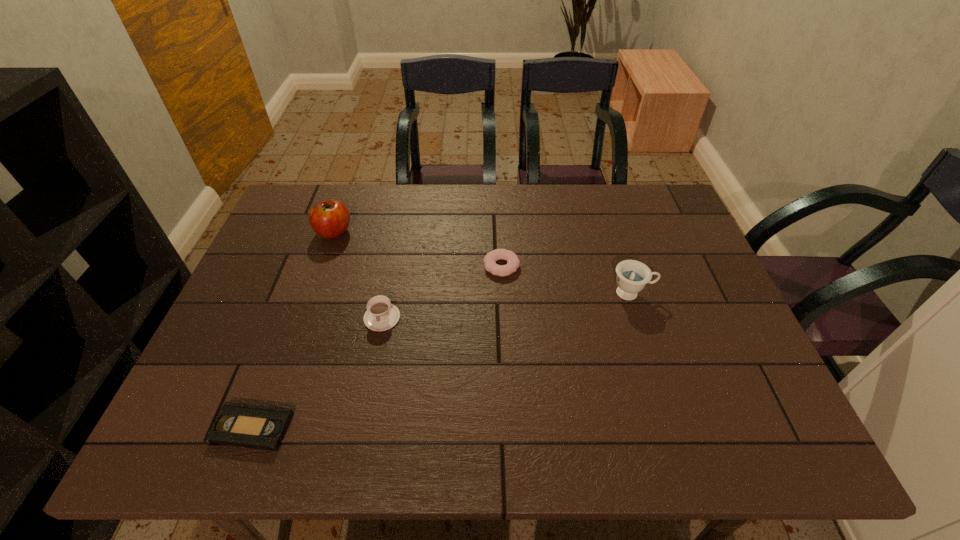
You are a GUI agent. You are given a task and a screenshot of the screen. Output one action in this format:
    pyautogui.click(x=<x>, y=<y>)
    Task: Click on the object positioned at the near left corner
    
    Given the screenshot: What is the action you would take?
    pyautogui.click(x=243, y=425)

Image resolution: width=960 pixels, height=540 pixels. I want to click on free spot at the far edge of the desktop, so click(x=351, y=190).

Where is `vacant point at the near edge`? This screenshot has width=960, height=540. vacant point at the near edge is located at coordinates (670, 415).

I want to click on vacant space at the left edge, so click(250, 280).

Where is `free region at the right edge`? This screenshot has height=540, width=960. free region at the right edge is located at coordinates (724, 369).

Locate an element on the screen. This screenshot has height=540, width=960. vacant space at the near right corner is located at coordinates (799, 449).

This screenshot has height=540, width=960. In order to click on blank region between the nearest object and the rightmost object in this screenshot , I will do coord(443,361).

Identify the location of free space between the rightmost object and the fourth tallest object. Image resolution: width=960 pixels, height=540 pixels. pyautogui.click(x=566, y=280).

At what (x,y) coordinates should I click in order to perform the action: click on free area in between the third object from left to right and the right teacup. Please return your answer as a coordinate pair (x, y). Looking at the image, I should click on (507, 305).

The image size is (960, 540). Find the location of `free space between the rightmost object and the farthest object`. free space between the rightmost object and the farthest object is located at coordinates (483, 262).